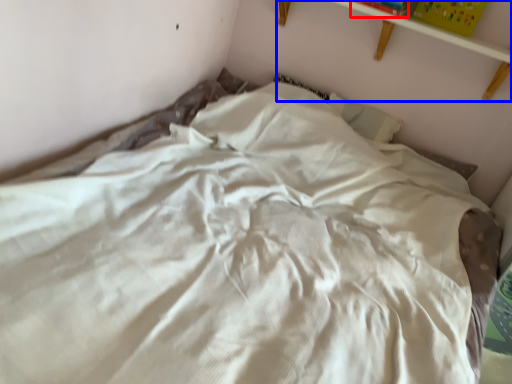
Question: Which point is further to the camera, paperback book (highlighted by a red box) or shelf (highlighted by a blue box)?

Choices:
 (A) paperback book
 (B) shelf

Answer: (A)